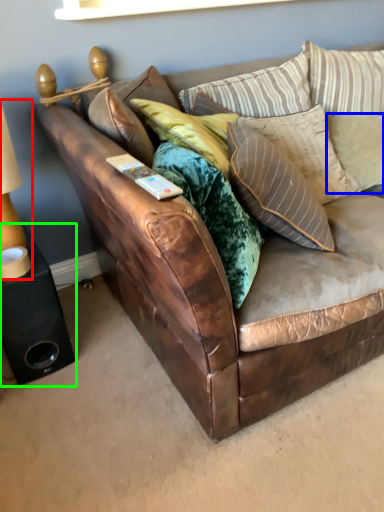
Question: Which object is positioned closest to table lamp (highlighted by a red box)? Select from pillow (highlighted by a blue box) and speaker (highlighted by a green box).

Choices:
 (A) pillow
 (B) speaker

Answer: (B)